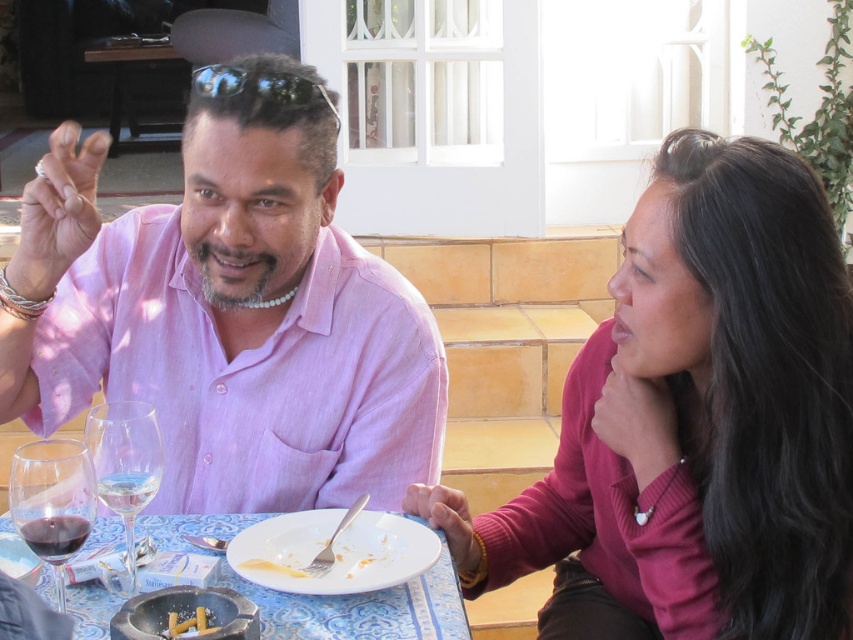
You are a server at the restaurant and need to place a dessert plate that is 12 inches in diameter on the table. The porcelain plate at center and the translucent glass wine glass at lower left are already there. Can the dessert plate fit on the table without overlapping either of them?

The porcelain plate at center is larger than the translucent glass wine glass at lower left. Since the dessert plate is 12 inches in diameter, it depends on the available space between the existing items. However, the description only provides size comparison between the two objects, not their exact positions or distances. Therefore, it is uncertain if the dessert plate will fit without overlapping.

You are a waiter at the restaurant and need to place a new dessert menu on the table. The menu is 10 cm wide. Is there enough space between the white matte plate at center and the clear glass wine glass at lower left to fit it?

The white matte plate at center is positioned under the clear glass wine glass at lower left, meaning they are stacked vertically. Since the menu is 10 cm wide, there should be sufficient horizontal space on the table to place it between them as they are not occupying the same horizontal plane.

What is the exact coordinate of the white matte plate at center?

The white matte plate at center is located at point (x=334, y=552).